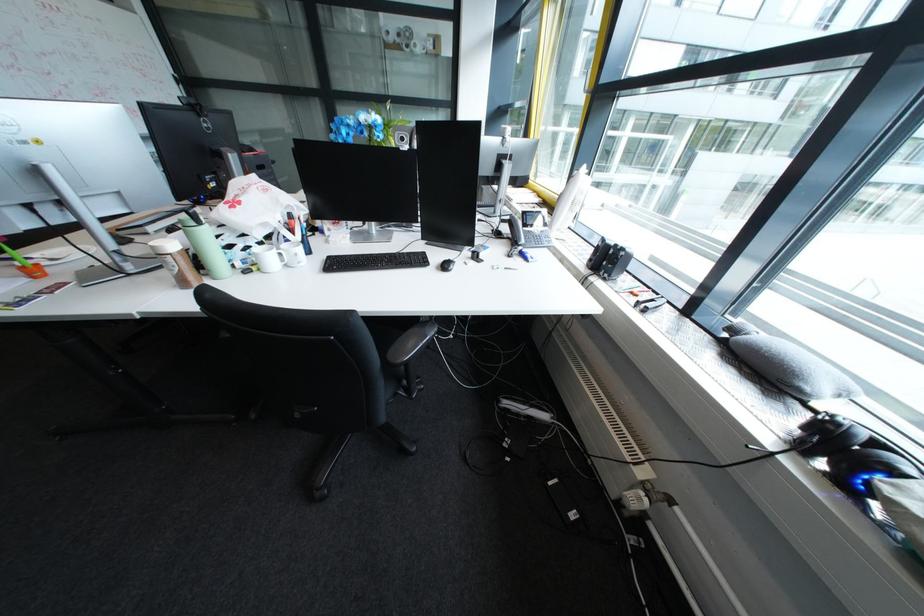
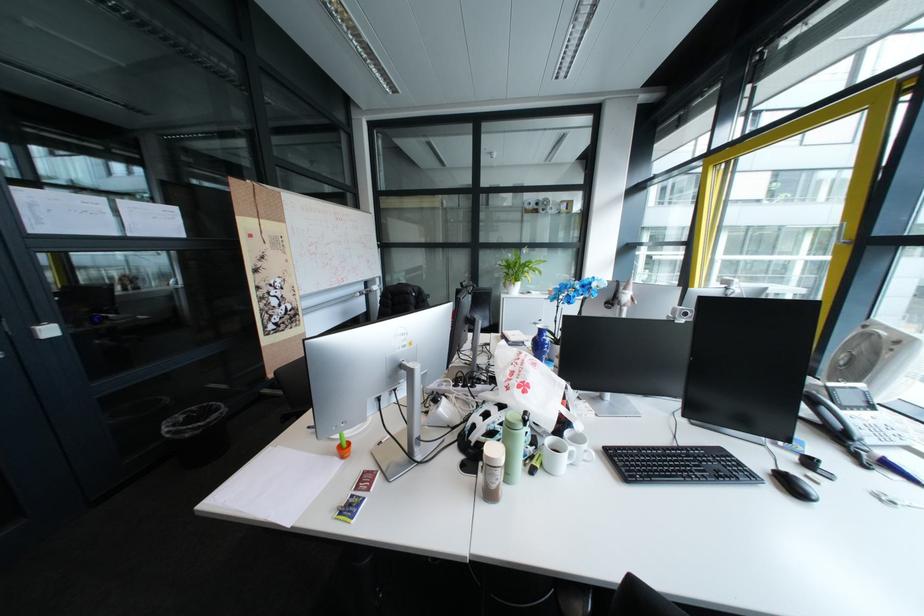
The point at (187,270) is marked in the first image. Where is the corresponding point in the second image?

(507, 484)